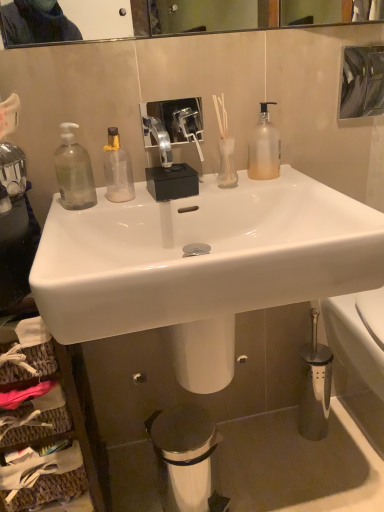
The width and height of the screenshot is (384, 512). I want to click on vacant area that lies to the right of translucent glass vase at center, so click(284, 184).